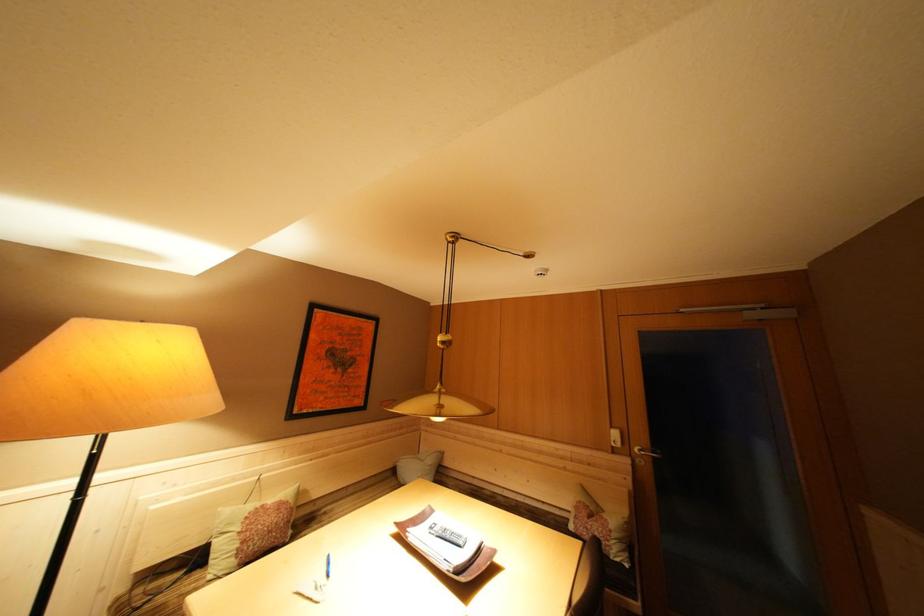
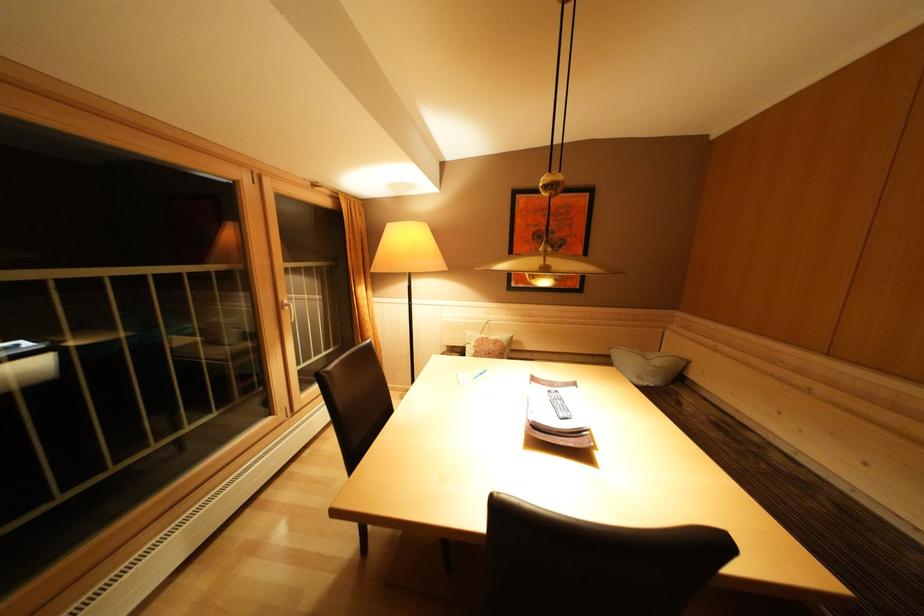
Question: How did the camera likely rotate?

Choices:
 (A) Left
 (B) Right
 (C) Up
 (D) Down

Answer: (A)